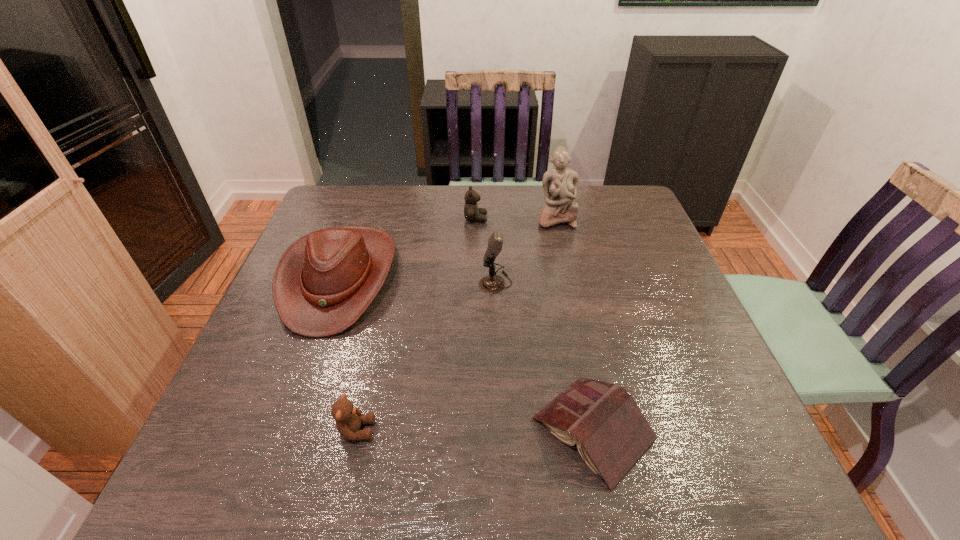
In order to click on vacant space located on the front-facing side of the microphone in this screenshot , I will do `click(420, 282)`.

Image resolution: width=960 pixels, height=540 pixels. Find the location of `vacant space situated on the front-facing side of the microphone`. vacant space situated on the front-facing side of the microphone is located at coordinates (378, 282).

Image resolution: width=960 pixels, height=540 pixels. In order to click on free space located 0.330m on the front-facing side of the cowboy hat in this screenshot , I will do `click(264, 488)`.

The image size is (960, 540). Find the location of `vacant area situated on the face of the right teddy bear`. vacant area situated on the face of the right teddy bear is located at coordinates (591, 219).

You are a GUI agent. You are given a task and a screenshot of the screen. Output one action in this format:
    pyautogui.click(x=<x>, y=<y>)
    Task: Click on the vacant space located 0.320m on the face of the shorter teddy bear
    Image resolution: width=960 pixels, height=540 pixels.
    Given the screenshot: What is the action you would take?
    pyautogui.click(x=543, y=430)

You are a GUI agent. You are given a task and a screenshot of the screen. Output one action in this format:
    pyautogui.click(x=<x>, y=<y>)
    Task: Click on the vacant region located on the right of the shortest object
    The width and height of the screenshot is (960, 540).
    Given the screenshot: What is the action you would take?
    pyautogui.click(x=685, y=429)

The width and height of the screenshot is (960, 540). In order to click on figurine that is positioned at the far edge in this screenshot , I will do `click(560, 185)`.

The width and height of the screenshot is (960, 540). Find the location of `teddy bear present at the far edge`. teddy bear present at the far edge is located at coordinates (471, 211).

Find the location of a particular element. This screenshot has width=960, height=540. object situated at the near edge is located at coordinates (611, 433).

Find the location of a particular element. object that is at the left edge is located at coordinates (323, 283).